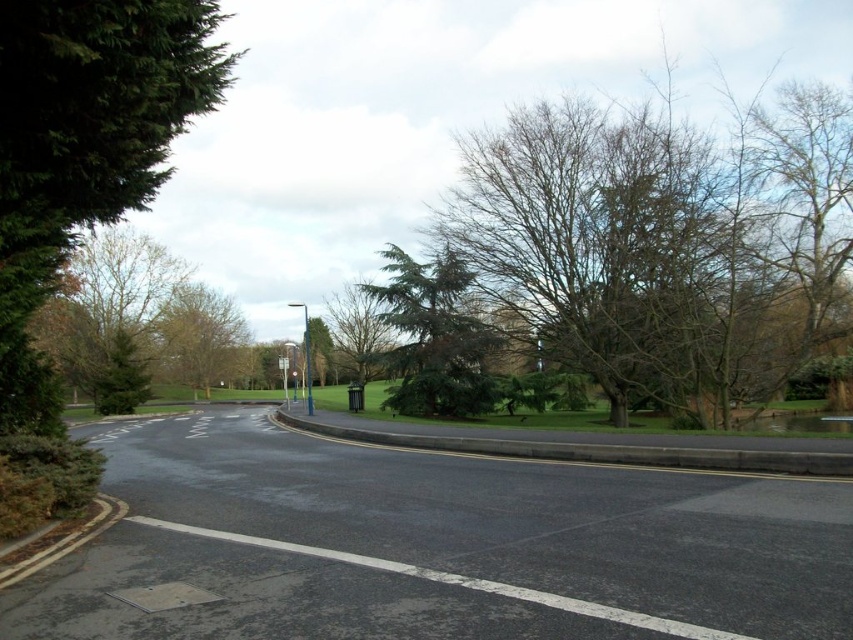
You are a delivery driver approaching the curved road. Your truck is 2.5 meters wide. There is a green textured tree at center and a metallic rectangular sign at center. Can your truck safely pass through the space between them?

The green textured tree at center might be wider than the metallic rectangular sign at center. Since the tree could be wider than the sign, the available space between them may be narrower than expected. If the tree is indeed wider, the 2.5 meter wide truck might not have enough clearance to pass safely. It is advisable to check the actual width or take an alternative route to avoid potential damage.